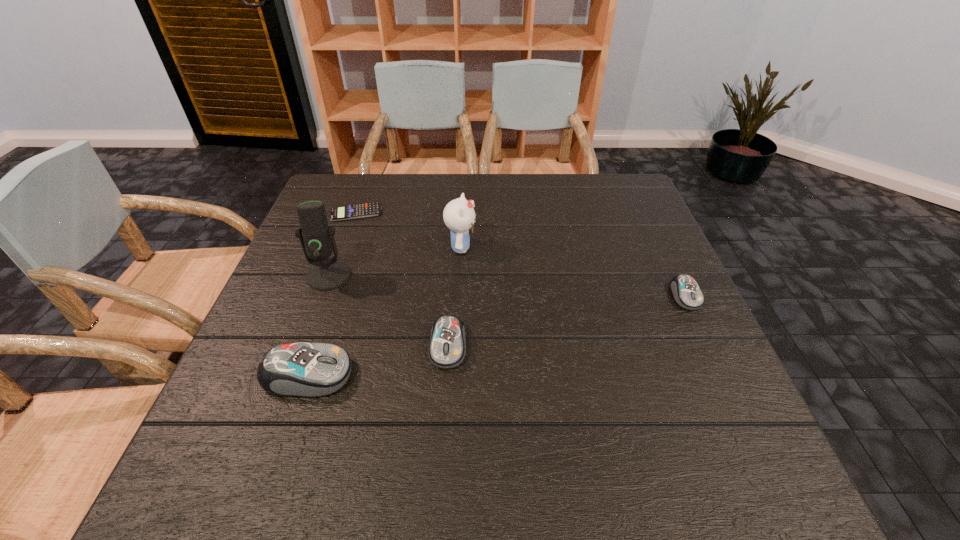
Please mark a free spot for a new mouse_(computer_equipment) to balance the arrangement. Please provide its 2D coordinates. Your answer should be formatted as a tuple, i.e. [(x, y)], where the tuple contains the x and y coordinates of a point satisfying the conditions above.

[(573, 319)]